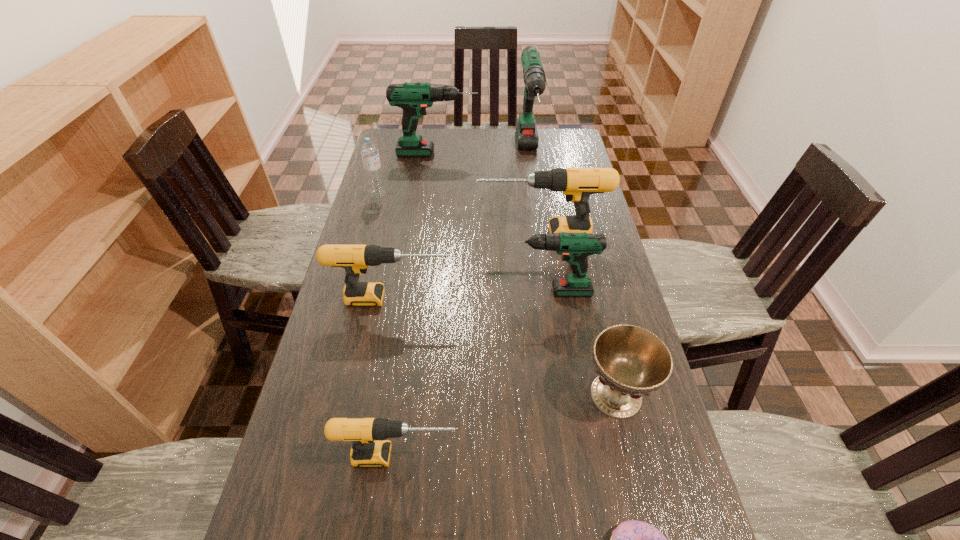
Image resolution: width=960 pixels, height=540 pixels. Find the location of `green drill object that ranks as the third closest to the second biggest black drill`. green drill object that ranks as the third closest to the second biggest black drill is located at coordinates (414, 98).

The image size is (960, 540). Identify the location of the third closest black drill relative to the seventh nearest object. [x=370, y=449].

Point out which black drill is positioned as the third nearest to the tallest drill. Please provide its 2D coordinates. Your answer should be formatted as a tuple, i.e. [(x, y)], where the tuple contains the x and y coordinates of a point satisfying the conditions above.

[(370, 449)]

Where is `vacant region that satisfies the following two spatial constraints: 1. on the handle side of the chalice; 2. on the left side of the biggest black drill`? This screenshot has height=540, width=960. vacant region that satisfies the following two spatial constraints: 1. on the handle side of the chalice; 2. on the left side of the biggest black drill is located at coordinates (564, 395).

You are a GUI agent. You are given a task and a screenshot of the screen. Output one action in this format:
    pyautogui.click(x=<x>, y=<y>)
    Task: Click on the vacant region that satisfies the following two spatial constraints: 1. on the handle side of the smallest green drill; 2. on the left side of the chalice
    The image size is (960, 540).
    Given the screenshot: What is the action you would take?
    pyautogui.click(x=564, y=395)